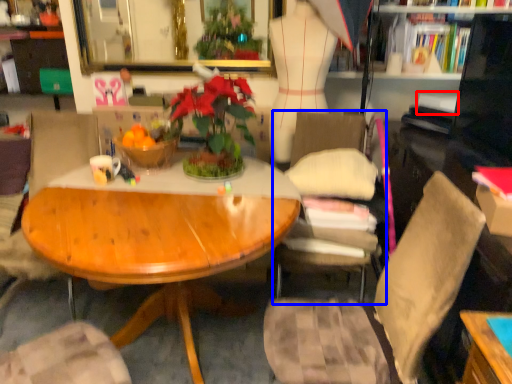
Question: Which point is further to the camera, book (highlighted by a red box) or chair (highlighted by a blue box)?

Choices:
 (A) book
 (B) chair

Answer: (A)